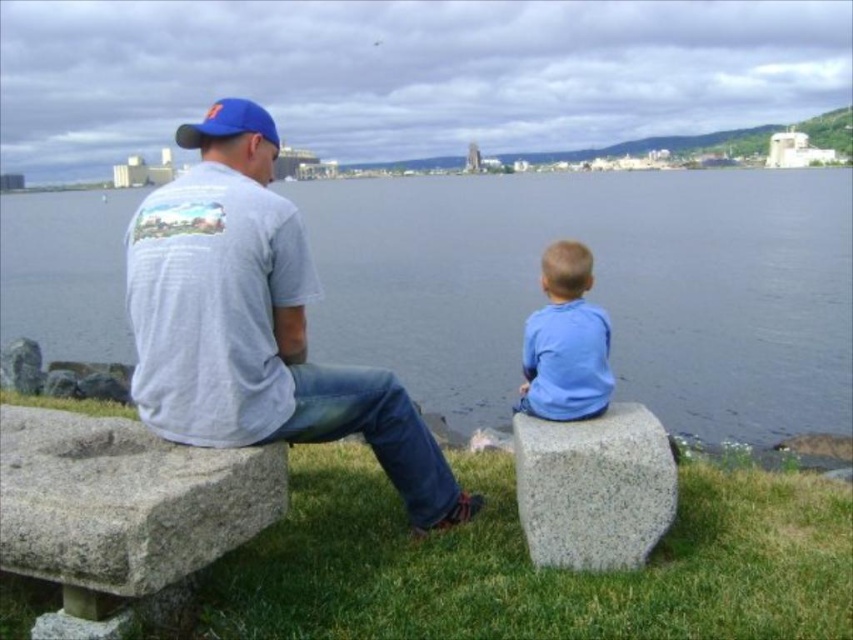
Question: Is blue water at center above blue fabric baseball cap at upper center?

Choices:
 (A) no
 (B) yes

Answer: (B)

Question: Which object is farther from the camera taking this photo?

Choices:
 (A) matte gray t-shirt at center
 (B) blue water at center
 (C) blue fabric baseball cap at upper center

Answer: (C)

Question: Which object is positioned closest to the granite stone at lower right?

Choices:
 (A) blue fabric baseball cap at upper center
 (B) blue water at center

Answer: (A)

Question: Which of the following is the farthest from the observer?

Choices:
 (A) (585, 317)
 (B) (527, 280)
 (C) (227, 108)
 (D) (138, 500)

Answer: (B)

Question: Is blue water at center wider than matte gray t-shirt at center?

Choices:
 (A) yes
 (B) no

Answer: (A)

Question: Can you confirm if matte gray t-shirt at center is bigger than granite stone at lower right?

Choices:
 (A) yes
 (B) no

Answer: (A)